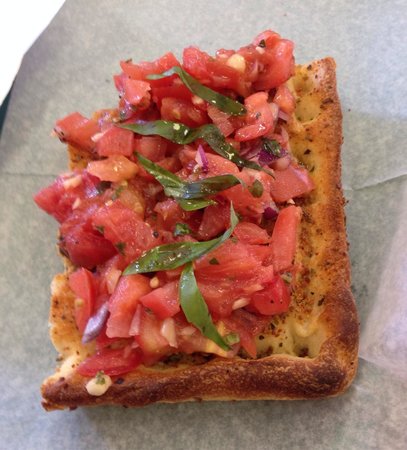
Locate an element on the screen. pinkish gray corner is located at coordinates [397, 440].